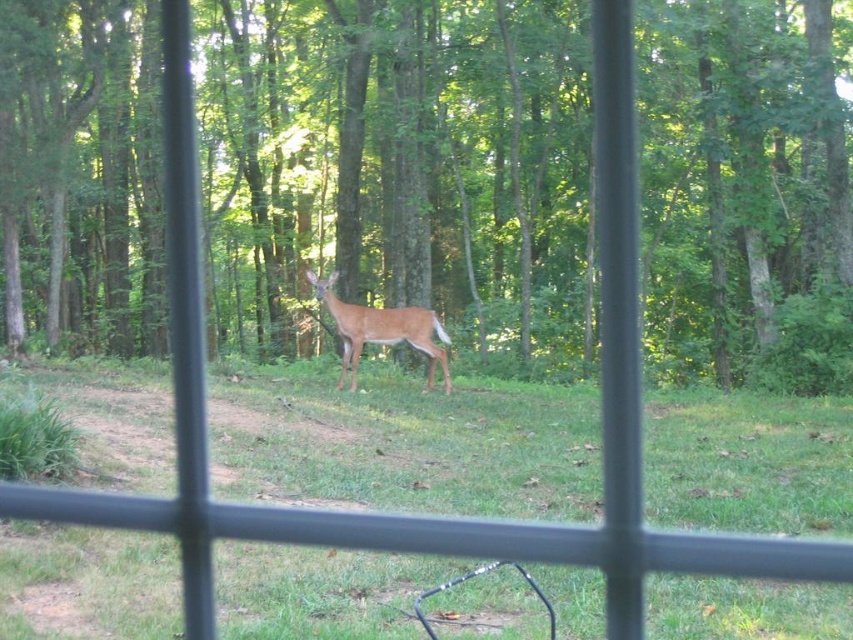
Is green grassy at center shorter than brown fur deer at center?

Correct, green grassy at center is not as tall as brown fur deer at center.

Measure the distance between point (360,620) and camera.

The distance of point (360,620) from camera is 5.65 meters.

The width and height of the screenshot is (853, 640). What are the coordinates of `green grassy at center` in the screenshot? It's located at (404, 442).